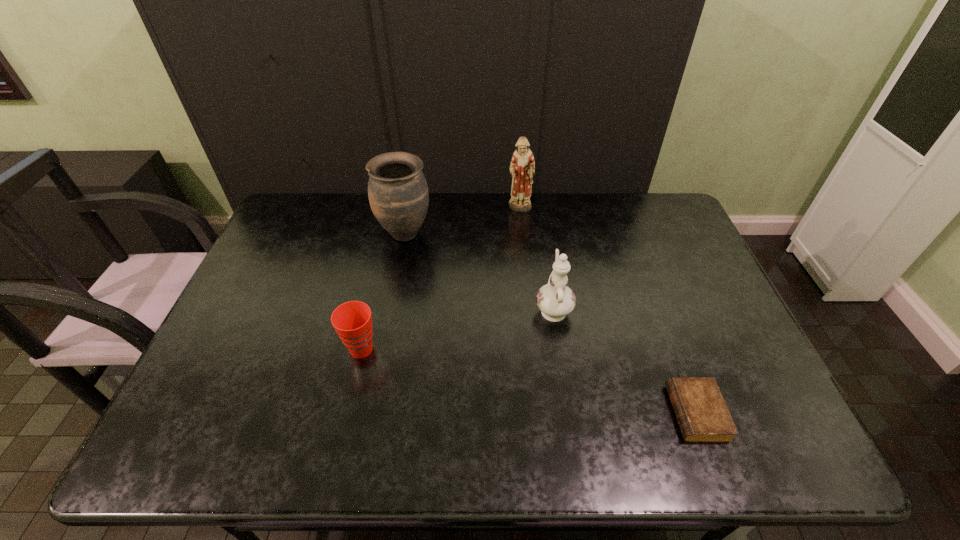
This screenshot has width=960, height=540. Identify the location of figurine. (522, 168).

Locate an element on the screen. urn is located at coordinates (398, 194).

The height and width of the screenshot is (540, 960). Find the location of `chinaware`. chinaware is located at coordinates (555, 300).

Image resolution: width=960 pixels, height=540 pixels. What are the coordinates of `the third tallest object` in the screenshot? It's located at (555, 300).

The image size is (960, 540). In order to click on the second nearest object in this screenshot , I will do `click(352, 321)`.

At what (x,y) coordinates should I click in order to perform the action: click on cup. Please return your answer as a coordinate pair (x, y). Looking at the image, I should click on (352, 321).

Identify the location of the nearest object. Image resolution: width=960 pixels, height=540 pixels. (702, 415).

Where is `diary`? The image size is (960, 540). diary is located at coordinates (702, 415).

This screenshot has width=960, height=540. What are the coordinates of `vacant space situated on the front-facing side of the figurine` in the screenshot? It's located at (525, 255).

You are a GUI agent. You are given a task and a screenshot of the screen. Output one action in this format:
    pyautogui.click(x=<x>, y=<y>)
    Task: Click on the free space located 0.070m on the right of the urn
    
    Given the screenshot: What is the action you would take?
    pyautogui.click(x=453, y=233)